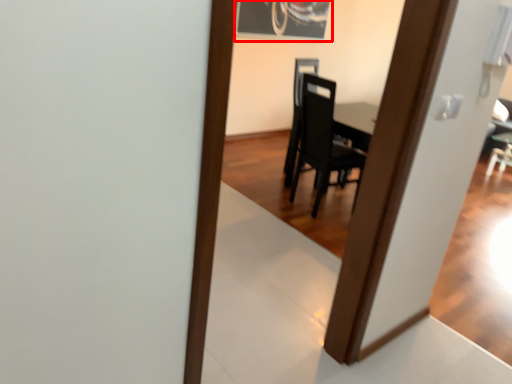
Question: From the image's perspective, where is picture frame (annotated by the red box) located relative to chair?

Choices:
 (A) below
 (B) above

Answer: (B)